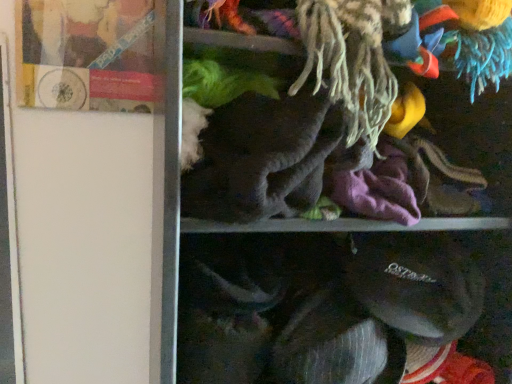
Question: In the image, is soft gray fabric at center positioned in front of or behind matte plastic book at upper left?

Choices:
 (A) front
 (B) behind

Answer: (A)

Question: Is soft gray fabric at center to the left or to the right of matte plastic book at upper left in the image?

Choices:
 (A) right
 (B) left

Answer: (A)

Question: Based on their sizes in the image, would you say soft gray fabric at center is bigger or smaller than matte plastic book at upper left?

Choices:
 (A) small
 (B) big

Answer: (B)

Question: Considering the relative positions of matte plastic book at upper left and soft gray fabric at center in the image provided, is matte plastic book at upper left to the left or to the right of soft gray fabric at center?

Choices:
 (A) right
 (B) left

Answer: (B)

Question: Is point (156, 11) closer or farther from the camera than point (456, 39)?

Choices:
 (A) closer
 (B) farther

Answer: (B)

Question: Is matte plastic book at upper left inside or outside of soft gray fabric at center?

Choices:
 (A) outside
 (B) inside

Answer: (A)

Question: Considering the positions of matte plastic book at upper left and soft gray fabric at center in the image, is matte plastic book at upper left wider or thinner than soft gray fabric at center?

Choices:
 (A) wide
 (B) thin

Answer: (B)